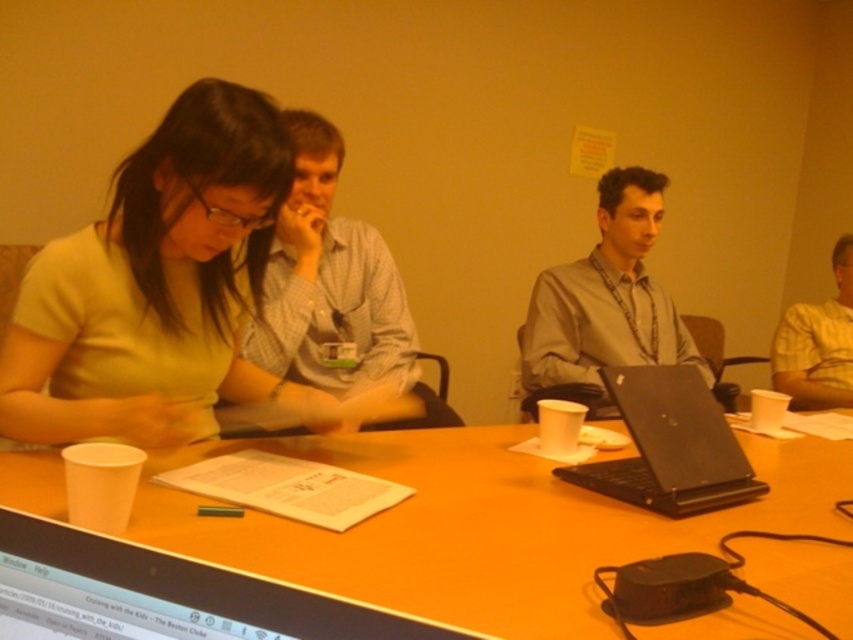
Question: Which point is closer to the camera taking this photo?

Choices:
 (A) (616, 289)
 (B) (732, 452)
 (C) (223, 234)
 (D) (219, 564)

Answer: (D)

Question: Estimate the real-world distances between objects in this image. Which object is farther from the yellow checkered shirt at right?

Choices:
 (A) wooden table at center
 (B) light blue shirt at center

Answer: (B)

Question: Is black glossy computer screen at lower left to the right of black matte laptop at center from the viewer's perspective?

Choices:
 (A) yes
 (B) no

Answer: (B)

Question: Which point is farther to the camera?

Choices:
 (A) light blue shirt at center
 (B) matte gray shirt at center
 (C) matte yellow shirt at center
 (D) black matte laptop at center

Answer: (B)

Question: Does matte yellow shirt at center have a larger size compared to matte gray shirt at center?

Choices:
 (A) no
 (B) yes

Answer: (A)

Question: Is matte gray shirt at center to the right of yellow checkered shirt at right from the viewer's perspective?

Choices:
 (A) no
 (B) yes

Answer: (A)